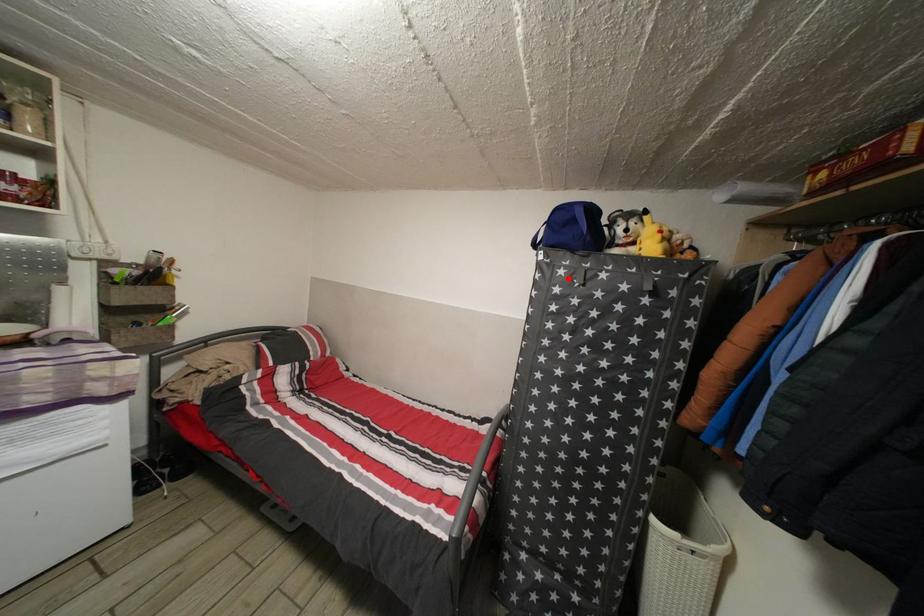
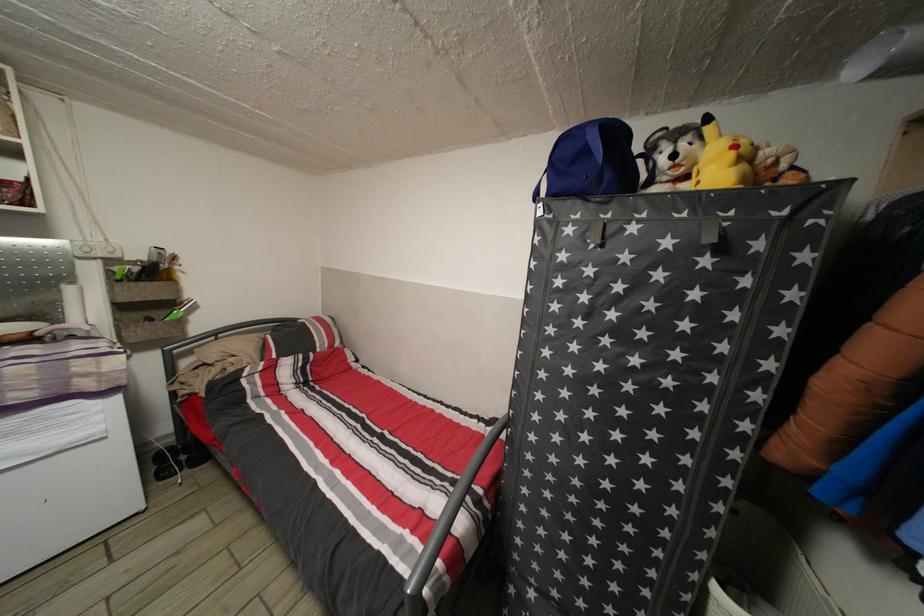
Locate, in the second image, the point that corresponds to the highlighted location in the first image.

(576, 237)